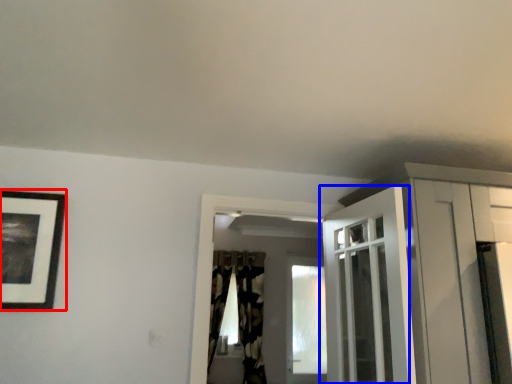
Question: Which of the following is the closest to the observer, picture frame (highlighted by a red box) or door (highlighted by a blue box)?

Choices:
 (A) picture frame
 (B) door

Answer: (B)